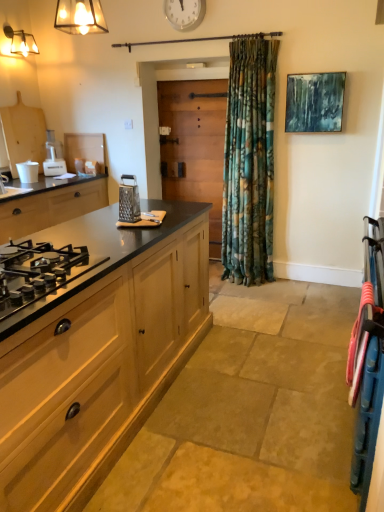
Question: Would you say white plastic clock at upper center is inside or outside black matte gas stove at left, marked as the second cabinetry in a bottom-to-top arrangement?

Choices:
 (A) inside
 (B) outside

Answer: (B)

Question: From a real-world perspective, is white plastic clock at upper center above or below black matte gas stove at left, the 1th cabinetry in the top-to-bottom sequence?

Choices:
 (A) above
 (B) below

Answer: (A)

Question: Which object is positioned farthest from the metallic grater at center?

Choices:
 (A) wooden cabinet at left, the second cabinetry positioned from the top
 (B) metallic glass light fixture at upper left
 (C) wooden at center
 (D) black matte gas stove at left, acting as the 2th cabinetry starting from the right
 (E) white plastic clock at upper center

Answer: (B)

Question: Which of these objects is positioned farthest from the wooden at center?

Choices:
 (A) white plastic clock at upper center
 (B) white plastic food processor at left, the second appliance in the bottom-to-top sequence
 (C) metallic glass light fixture at upper left
 (D) black matte gas stove at left, the 1th cabinetry in the top-to-bottom sequence
 (E) metallic grater at center

Answer: (C)